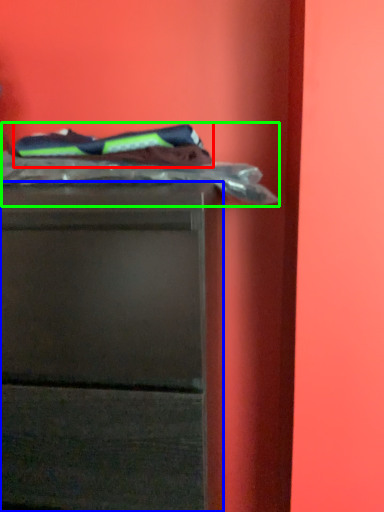
Question: Which object is positioned farthest from laundry (highlighted by a red box)? Select from chest of drawers (highlighted by a blue box) and laundry (highlighted by a green box).

Choices:
 (A) chest of drawers
 (B) laundry

Answer: (A)